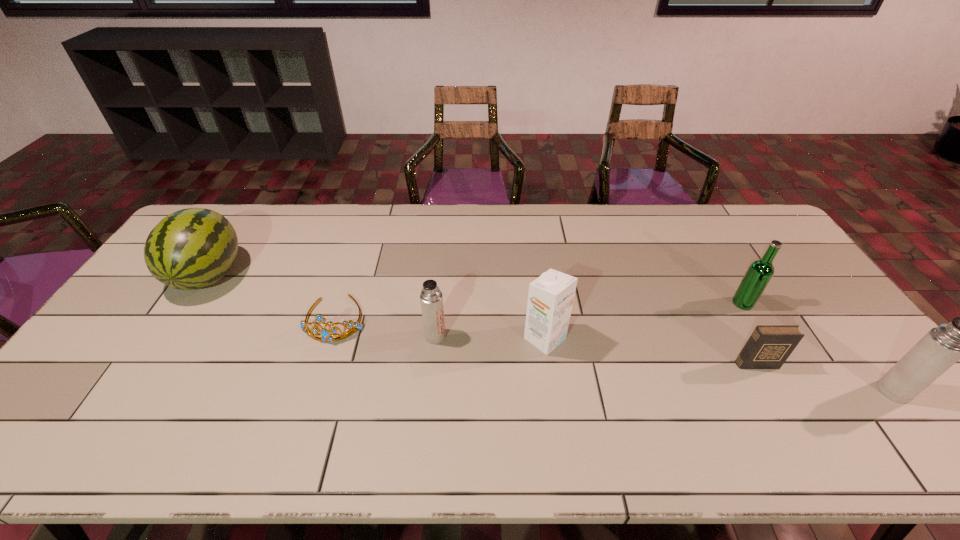
You are a GUI agent. You are given a task and a screenshot of the screen. Output one action in this format:
    pyautogui.click(x=<x>, y=<y>)
    Task: Click on the object that is at the right edge
    Image resolution: width=960 pixels, height=540 pixels.
    Given the screenshot: What is the action you would take?
    pyautogui.click(x=942, y=346)

Locate an element on the screen. Image resolution: width=960 pixels, height=540 pixels. object that is positioned at the near right corner is located at coordinates (942, 346).

Find the location of `free space at the far edge`. free space at the far edge is located at coordinates (284, 227).

Find the location of a particular element. The image size is (960, 540). free space at the right edge is located at coordinates (801, 279).

Identify the location of vacant area at the far left corner of the desktop. (233, 220).

Where is `vacant area that lies between the carton and the diary`? The image size is (960, 540). vacant area that lies between the carton and the diary is located at coordinates (651, 352).

Locate an element on the screen. This screenshot has width=960, height=540. free spot between the beer bottle and the carton is located at coordinates (644, 321).

Locate an element on the screen. free space that is in between the fourth object from left to right and the beer bottle is located at coordinates (644, 321).

You are a GUI agent. You are given a task and a screenshot of the screen. Output one action in this format:
    pyautogui.click(x=<x>, y=<y>)
    Task: Click on the empty space between the watermelon and the sixth tallest object
    Image resolution: width=960 pixels, height=540 pixels.
    Given the screenshot: What is the action you would take?
    pyautogui.click(x=483, y=320)

Identify the location of free spot between the carton and the taller thermos bottle. The height and width of the screenshot is (540, 960). (719, 365).